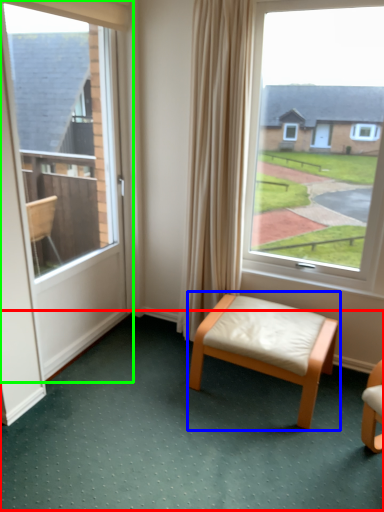
Question: Which object is the farthest from golf course (highlighted by a red box)? Choose among these: stool (highlighted by a blue box) or door (highlighted by a green box).

Choices:
 (A) stool
 (B) door

Answer: (B)